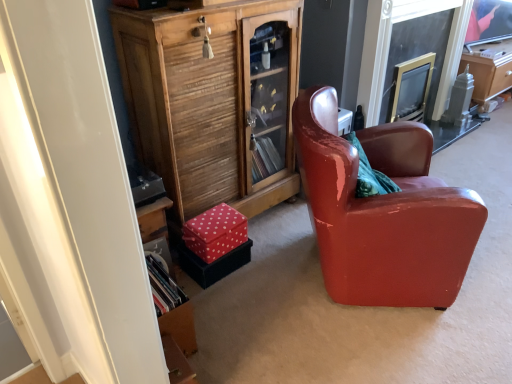
Question: Is there a large distance between glossy leather armchair at center and wooden cabinet at lower left?

Choices:
 (A) no
 (B) yes

Answer: (A)

Question: From a real-world perspective, is glossy leather armchair at center located higher than wooden cabinet at lower left?

Choices:
 (A) no
 (B) yes

Answer: (A)

Question: Is glossy leather armchair at center outside wooden cabinet at lower left?

Choices:
 (A) yes
 (B) no

Answer: (A)

Question: Is glossy leather armchair at center shorter than wooden cabinet at lower left?

Choices:
 (A) yes
 (B) no

Answer: (A)

Question: Is wooden cabinet at lower left surrounded by glossy leather armchair at center?

Choices:
 (A) no
 (B) yes

Answer: (A)

Question: From the image's perspective, is glossy leather armchair at center over wooden cabinet at lower left?

Choices:
 (A) yes
 (B) no

Answer: (B)

Question: Is wooden cabinet at lower left looking in the opposite direction of glossy leather armchair at center?

Choices:
 (A) no
 (B) yes

Answer: (A)

Question: From a real-world perspective, does wooden cabinet at lower left sit lower than glossy leather armchair at center?

Choices:
 (A) no
 (B) yes

Answer: (A)

Question: Could you tell me if wooden cabinet at lower left is turned towards glossy leather armchair at center?

Choices:
 (A) yes
 (B) no

Answer: (A)

Question: Is wooden cabinet at lower left further to the viewer compared to glossy leather armchair at center?

Choices:
 (A) no
 (B) yes

Answer: (B)

Question: Does wooden cabinet at lower left contain glossy leather armchair at center?

Choices:
 (A) no
 (B) yes

Answer: (A)

Question: From the image's perspective, is wooden cabinet at lower left beneath glossy leather armchair at center?

Choices:
 (A) no
 (B) yes

Answer: (A)

Question: Is wooden cabinet at lower left taller or shorter than glossy leather armchair at center?

Choices:
 (A) short
 (B) tall

Answer: (B)